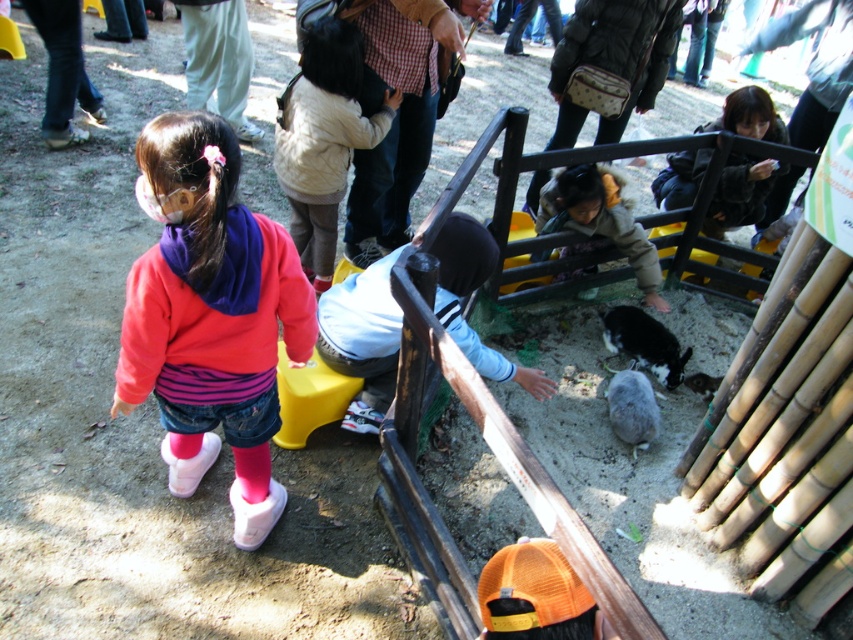
Does white fuzzy jacket at center come behind black and white fur rabbit at center?

No, it is not.

Which is in front, point (364, 122) or point (671, 365)?

Point (364, 122)

The width and height of the screenshot is (853, 640). Find the location of `white fuzzy jacket at center`. white fuzzy jacket at center is located at coordinates (323, 138).

Between point (634, 355) and point (708, 384), which one is positioned behind?

The point (634, 355) is more distant.

Is point (637, 337) positioned after point (700, 390)?

Yes, point (637, 337) is farther from viewer.

Image resolution: width=853 pixels, height=640 pixels. What are the coordinates of `black and white fur rabbit at center` in the screenshot? It's located at (645, 342).

Is point (657, 259) more distant than point (695, 376)?

Yes, it is.

The height and width of the screenshot is (640, 853). What are the coordinates of `light brown plush jacket at center` in the screenshot? It's located at (601, 220).

Measure the distance between light brown plush jacket at center and camera.

light brown plush jacket at center is 3.47 meters away from camera.

Identify the location of light brown plush jacket at center. This screenshot has width=853, height=640. (601, 220).